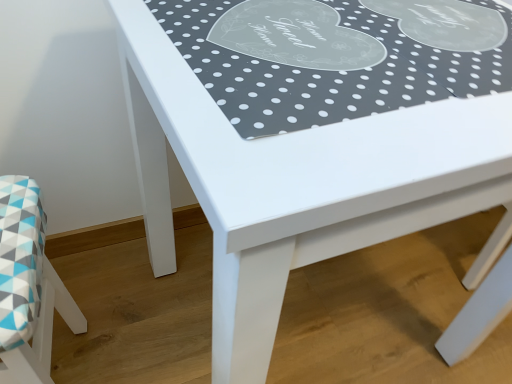
Question: From the image's perspective, is polka dot fabric placemat at upper center below geometric fabric cushion at lower left?

Choices:
 (A) yes
 (B) no

Answer: (B)

Question: Is polka dot fabric placemat at upper center positioned with its back to geometric fabric cushion at lower left?

Choices:
 (A) no
 (B) yes

Answer: (A)

Question: Is polka dot fabric placemat at upper center wider than geometric fabric cushion at lower left?

Choices:
 (A) yes
 (B) no

Answer: (A)

Question: From a real-world perspective, is polka dot fabric placemat at upper center positioned under geometric fabric cushion at lower left based on gravity?

Choices:
 (A) no
 (B) yes

Answer: (A)

Question: Considering the relative sizes of polka dot fabric placemat at upper center and geometric fabric cushion at lower left in the image provided, is polka dot fabric placemat at upper center smaller than geometric fabric cushion at lower left?

Choices:
 (A) no
 (B) yes

Answer: (B)

Question: Can you confirm if polka dot fabric placemat at upper center is shorter than geometric fabric cushion at lower left?

Choices:
 (A) yes
 (B) no

Answer: (A)

Question: Does geometric fabric cushion at lower left have a greater width compared to polka dot fabric placemat at upper center?

Choices:
 (A) no
 (B) yes

Answer: (A)

Question: Is geometric fabric cushion at lower left thinner than polka dot fabric placemat at upper center?

Choices:
 (A) no
 (B) yes

Answer: (B)

Question: From a real-world perspective, is geometric fabric cushion at lower left over polka dot fabric placemat at upper center?

Choices:
 (A) yes
 (B) no

Answer: (B)

Question: Does geometric fabric cushion at lower left contain polka dot fabric placemat at upper center?

Choices:
 (A) no
 (B) yes

Answer: (A)

Question: Can you confirm if geometric fabric cushion at lower left is positioned to the left of polka dot fabric placemat at upper center?

Choices:
 (A) yes
 (B) no

Answer: (A)

Question: From a real-world perspective, does geometric fabric cushion at lower left sit lower than polka dot fabric placemat at upper center?

Choices:
 (A) no
 (B) yes

Answer: (B)

Question: From a real-world perspective, is polka dot fabric placemat at upper center above or below geometric fabric cushion at lower left?

Choices:
 (A) above
 (B) below

Answer: (A)